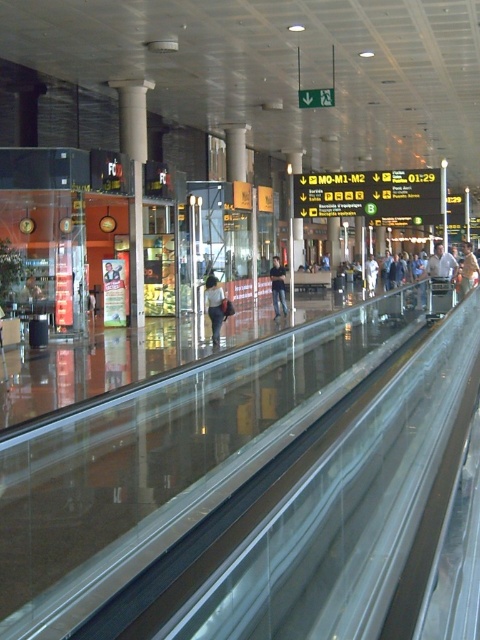
Based on the photo, between dark blue jeans at center and white fabric bag at center, which one has more height?

With more height is dark blue jeans at center.

Is point (276, 301) positioned behind point (119, 269)?

Yes.

In the scene shown: Who is more distant from viewer, (278, 266) or (116, 275)?

Positioned behind is point (278, 266).

Locate an element on the screen. This screenshot has height=640, width=480. dark blue jeans at center is located at coordinates (277, 288).

Based on the photo, does light brown leather jacket at right have a greater height compared to dark brown leather bag at center?

Correct, light brown leather jacket at right is much taller as dark brown leather bag at center.

Does point (471, 273) come in front of point (0, 324)?

No, it is not.

Which is in front, point (469, 282) or point (2, 317)?

Point (2, 317) is more forward.

I want to click on light brown leather jacket at right, so click(468, 269).

How far apart are light brown leather jacket at center and dark brown leather jacket at center?

light brown leather jacket at center and dark brown leather jacket at center are 13.73 meters apart from each other.

I want to click on light brown leather jacket at center, so click(x=441, y=264).

In order to click on light brown leather jacket at center in this screenshot , I will do `click(441, 264)`.

Where is `light brown leather jacket at center`? light brown leather jacket at center is located at coordinates (441, 264).